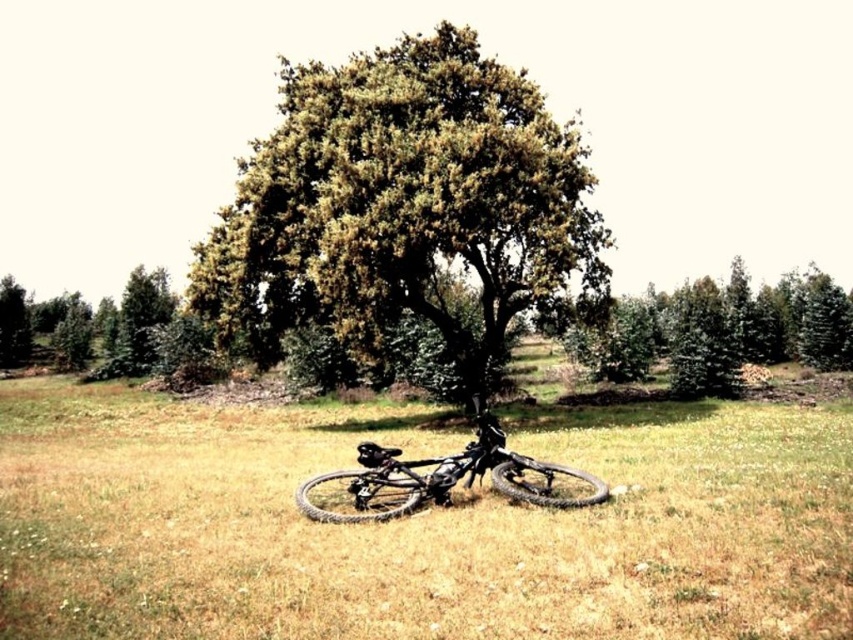
Question: Can you confirm if green leafy tree at center is wider than green matte tree at right?

Choices:
 (A) yes
 (B) no

Answer: (B)

Question: Can you confirm if green matte tree at right is positioned below shiny metallic bicycle at center?

Choices:
 (A) no
 (B) yes

Answer: (A)

Question: Which of these objects is positioned farthest from the green leafy tree at left?

Choices:
 (A) black rubber bicycle at center
 (B) green leafy tree at center
 (C) green matte tree at right

Answer: (C)

Question: Which of these objects is positioned closest to the black rubber bicycle at center?

Choices:
 (A) shiny metallic bicycle at center
 (B) green leafy tree at center
 (C) green leafy tree at left

Answer: (B)

Question: Observing the image, what is the correct spatial positioning of black rubber bicycle at center in reference to green leafy tree at left?

Choices:
 (A) right
 (B) left

Answer: (A)

Question: Which point is farther to the camera?

Choices:
 (A) green matte tree at right
 (B) shiny metallic bicycle at center
 (C) green leafy tree at center

Answer: (A)